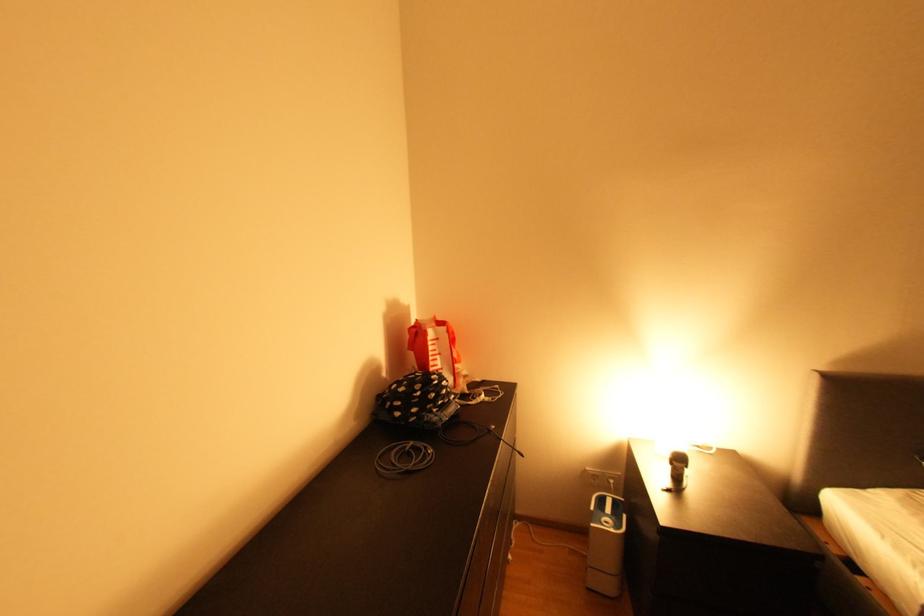
Identify the location of red bag handle. The width and height of the screenshot is (924, 616). (435, 349).